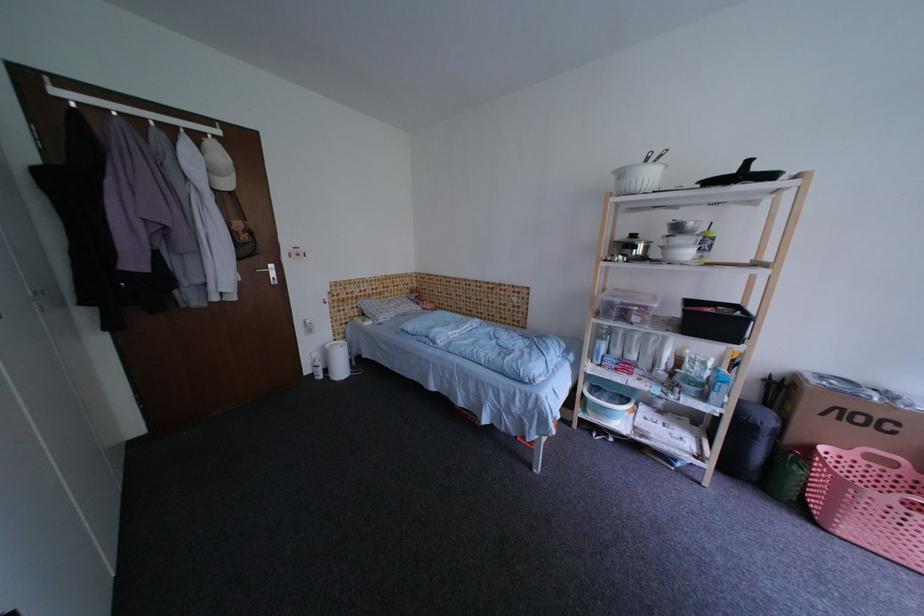
What do you see at coordinates (217, 164) in the screenshot? I see `a white baseball cap` at bounding box center [217, 164].